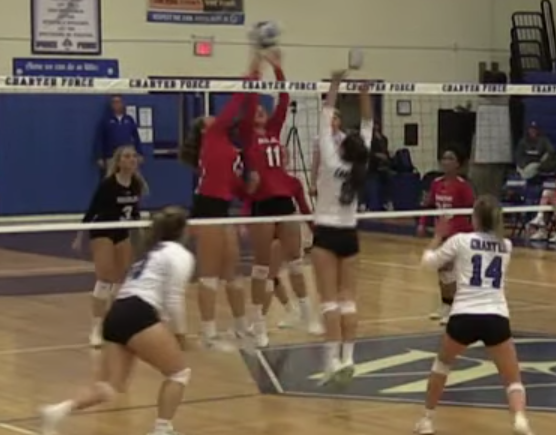
Where is `blue wall`? blue wall is located at coordinates (58, 182).